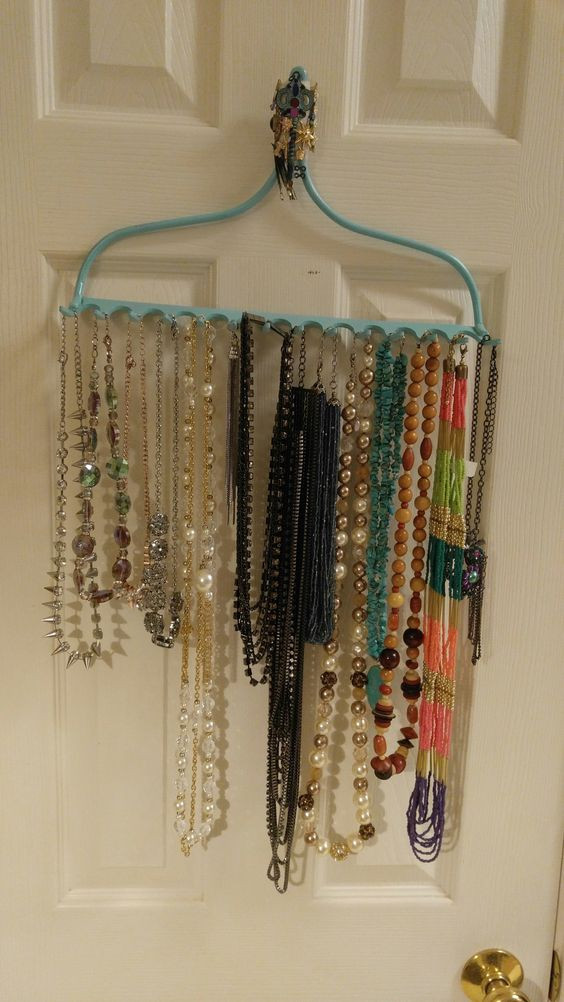
Identify the location of necklace organizer. (481, 321).